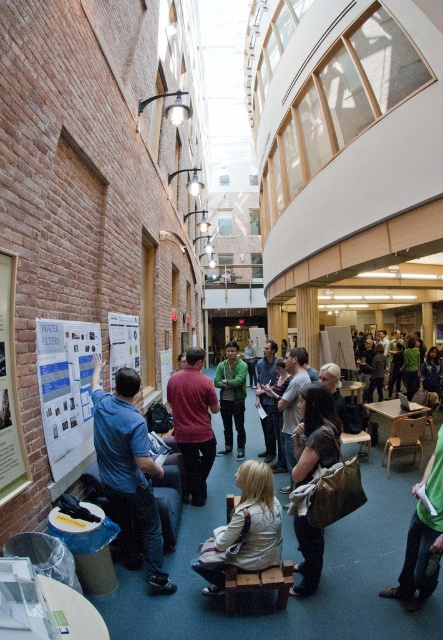
Question: Does blue paper poster at left appear on the right side of matte red shirt at center?

Choices:
 (A) no
 (B) yes

Answer: (A)

Question: Is matte red shirt at center in front of green matte jacket at center?

Choices:
 (A) yes
 (B) no

Answer: (A)

Question: Can you confirm if brown textured bag at center is bigger than white paperboard at left?

Choices:
 (A) yes
 (B) no

Answer: (A)

Question: Which point is farther from the camera taking this photo?

Choices:
 (A) (310, 550)
 (B) (194, 378)
 (C) (150, 518)
 (D) (128, 316)

Answer: (D)

Question: Considering the real-world distances, which object is farthest from the green matte jacket at center?

Choices:
 (A) blue denim jeans at left
 (B) green fabric shirt at lower right

Answer: (B)

Question: Which of the following is the farthest from the observer?

Choices:
 (A) (53, 339)
 (B) (240, 420)

Answer: (B)